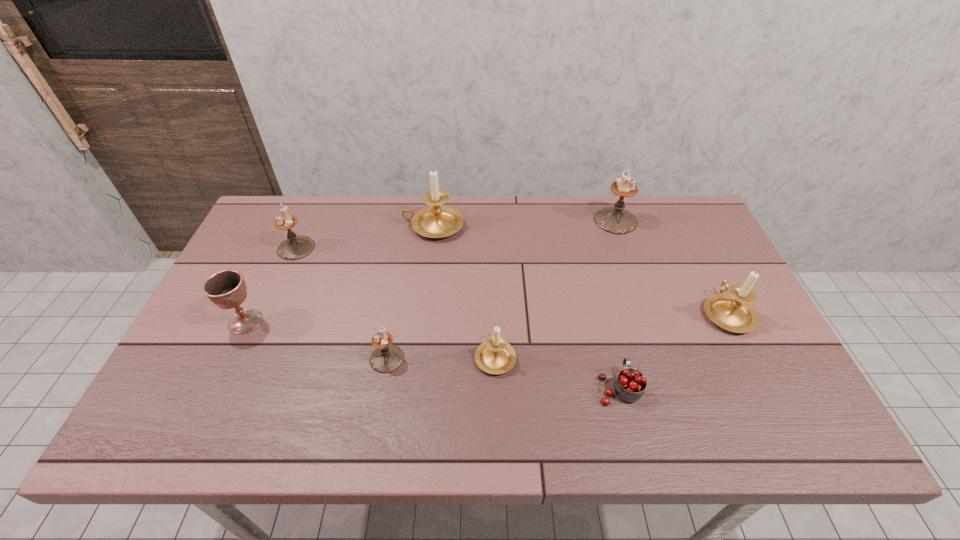
In order to click on vacant space situated 0.400m on the handle side of the red cherry in this screenshot , I will do `click(587, 255)`.

At what (x,y) coordinates should I click in order to perform the action: click on object positioned at the near edge. Please return your answer as a coordinate pair (x, y). Looking at the image, I should click on (630, 384).

This screenshot has height=540, width=960. I want to click on candle holder that is at the left edge, so click(295, 247).

You are a GUI agent. You are given a task and a screenshot of the screen. Output one action in this format:
    pyautogui.click(x=<x>, y=<y>)
    Task: Click on the chalice present at the left edge
    This screenshot has height=540, width=960.
    Given the screenshot: What is the action you would take?
    pyautogui.click(x=227, y=289)

You are a GUI agent. You are given a task and a screenshot of the screen. Output one action in this format:
    pyautogui.click(x=<x>, y=<y>)
    Task: Click on the object located at the right edge
    
    Given the screenshot: What is the action you would take?
    pyautogui.click(x=732, y=312)

The width and height of the screenshot is (960, 540). I want to click on object that is at the far left corner, so click(x=295, y=247).

In the image, there is a desktop. Where is `free region at the far edge`? free region at the far edge is located at coordinates (470, 233).

Locate an element on the screen. free space at the near edge is located at coordinates (453, 418).

The height and width of the screenshot is (540, 960). I want to click on vacant area at the left edge of the desktop, so click(181, 363).

At what (x,y) coordinates should I click in order to perform the action: click on free space at the right edge. Please return your answer as a coordinate pair (x, y). This screenshot has width=960, height=540. Looking at the image, I should click on (732, 356).